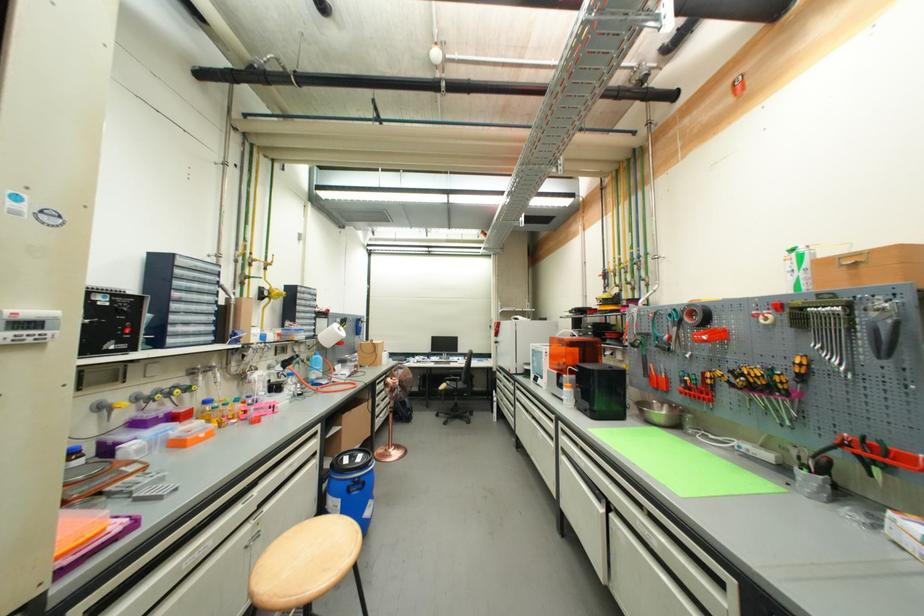
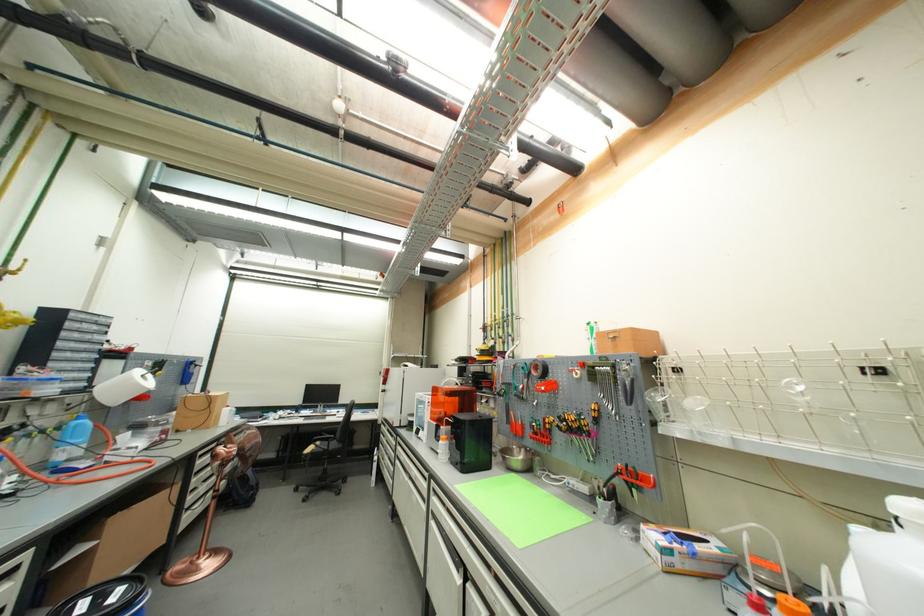
In the second image, find the point that corresponds to pixel 350 415 in the first image.

(123, 515)